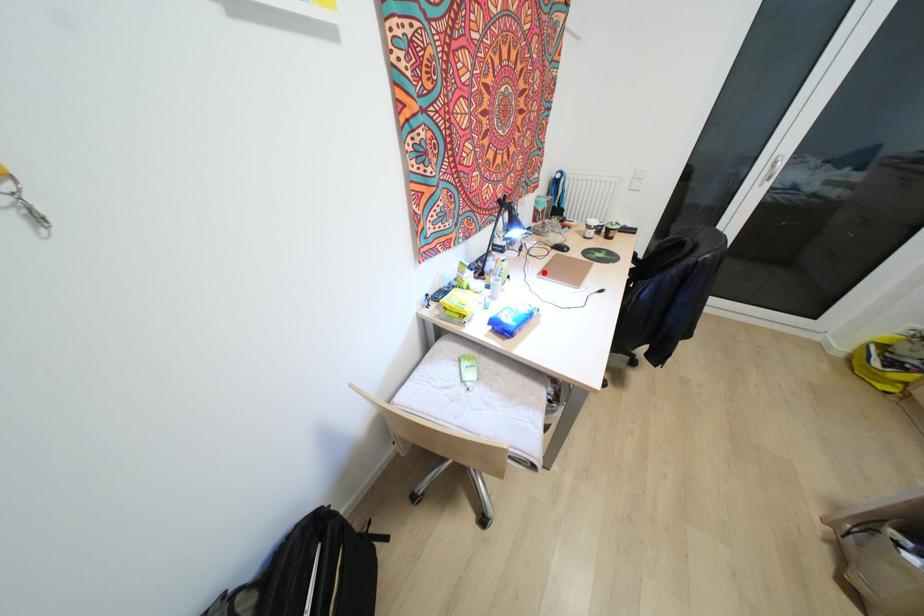
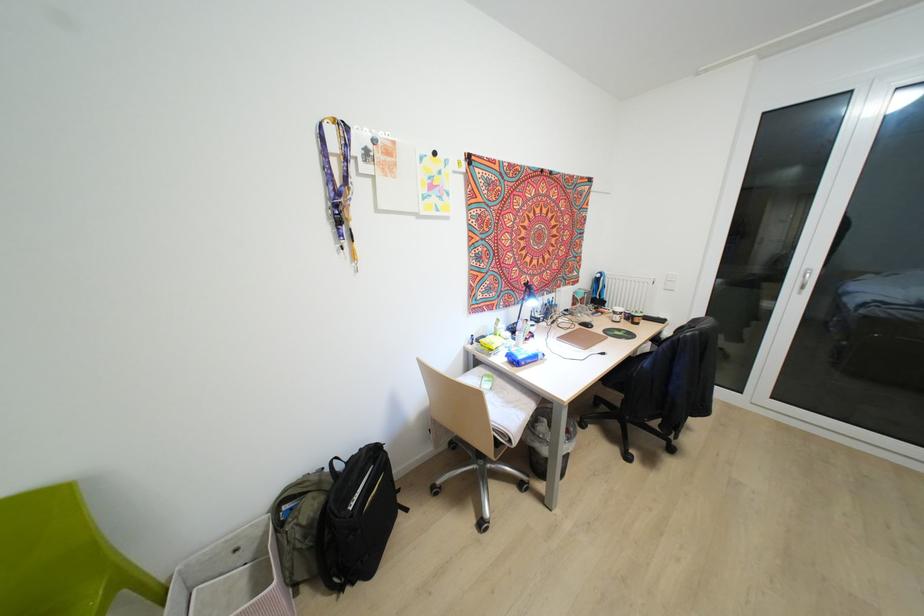
The point at the highlighted location is marked in the first image. Where is the corresponding point in the second image?

(563, 338)